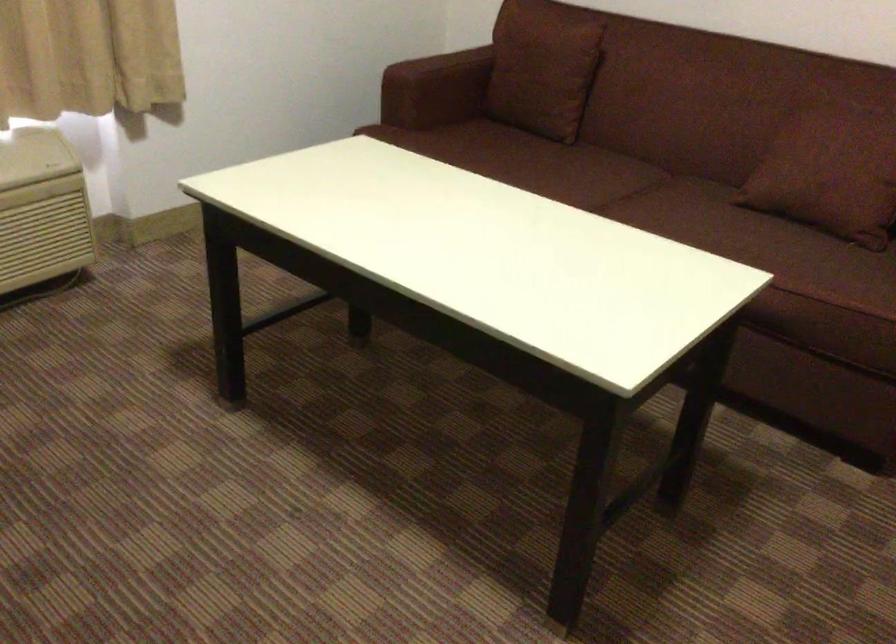
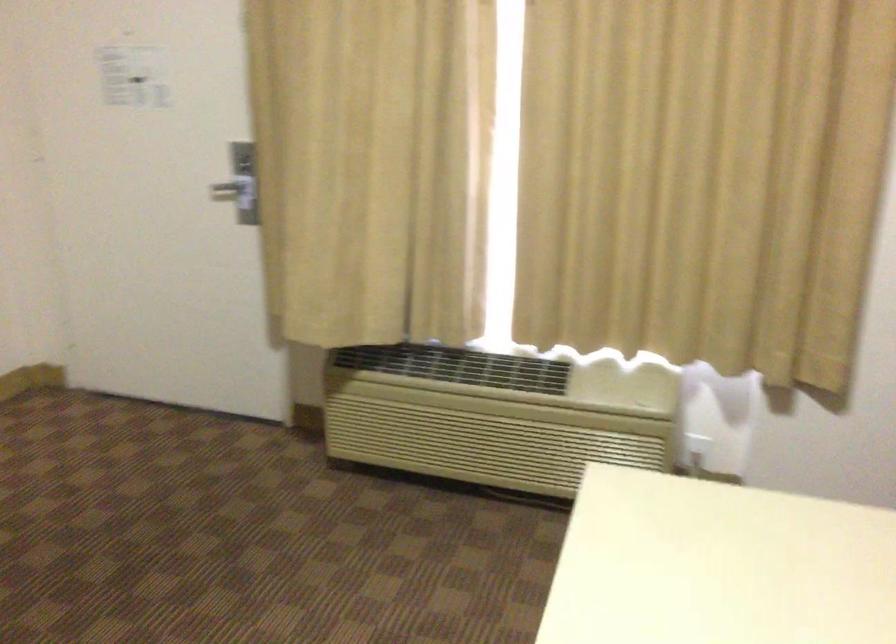
Question: Based on the continuous images, in which direction is the camera rotating? Reply with the corresponding letter.

Choices:
 (A) Left
 (B) Right
 (C) Up
 (D) Down

Answer: (A)